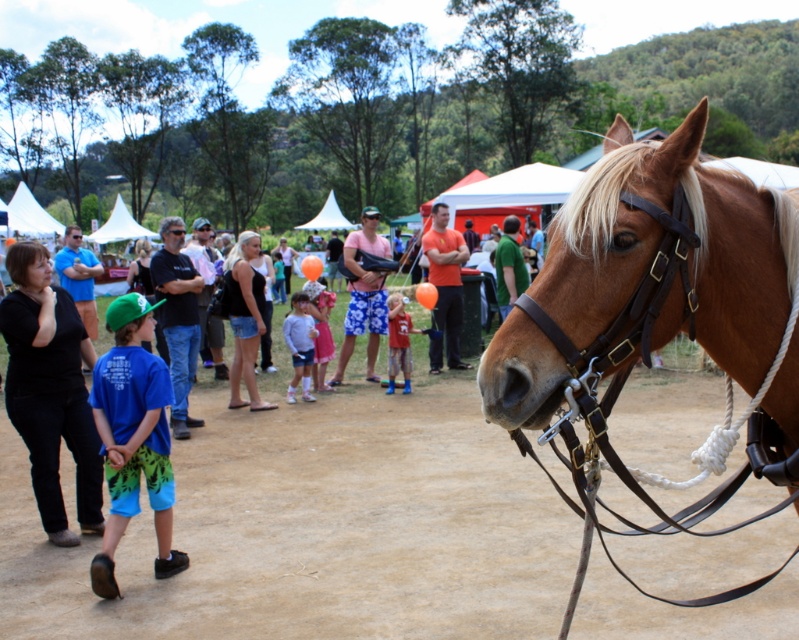
Based on the photo, can you confirm if black denim shorts at center is positioned to the right of matte blue shirt at center?

Incorrect, black denim shorts at center is not on the right side of matte blue shirt at center.

Identify the location of black denim shorts at center. (244, 317).

Which of these two, orange cotton shirt at center or green fabric shirt at center, stands shorter?

With less height is green fabric shirt at center.

Who is positioned more to the right, orange cotton shirt at center or green fabric shirt at center?

Positioned to the right is green fabric shirt at center.

Does point (436, 252) lie in front of point (515, 278)?

Yes, it is in front of point (515, 278).

Where is `orange cotton shirt at center`? This screenshot has width=799, height=640. orange cotton shirt at center is located at coordinates (446, 280).

What do you see at coordinates (654, 285) in the screenshot? The width and height of the screenshot is (799, 640). I see `brown leather horse at right` at bounding box center [654, 285].

Does brown leather horse at right have a greater width compared to matte blue shirt at center?

Correct, the width of brown leather horse at right exceeds that of matte blue shirt at center.

The width and height of the screenshot is (799, 640). What do you see at coordinates (654, 285) in the screenshot?
I see `brown leather horse at right` at bounding box center [654, 285].

Where is `brown leather horse at right`? brown leather horse at right is located at coordinates (654, 285).